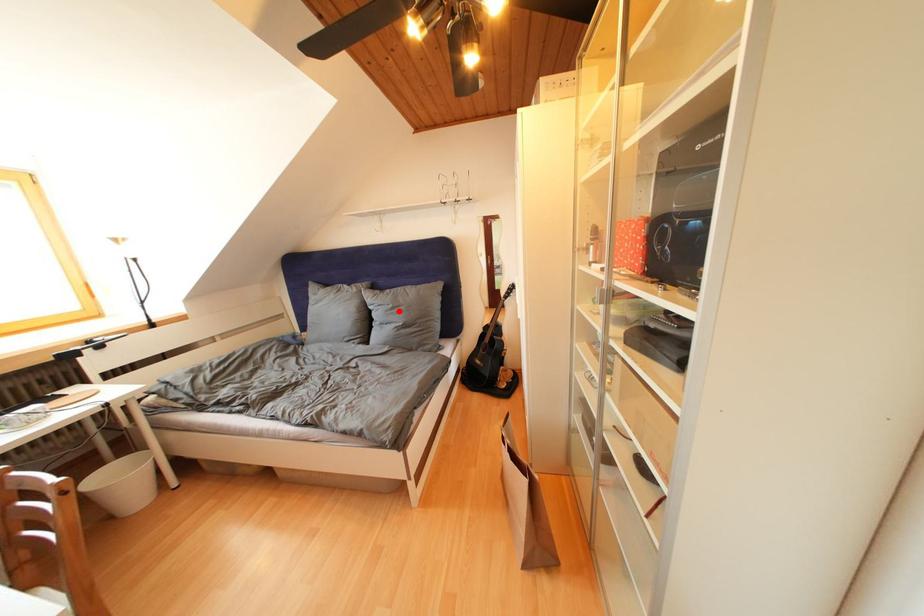
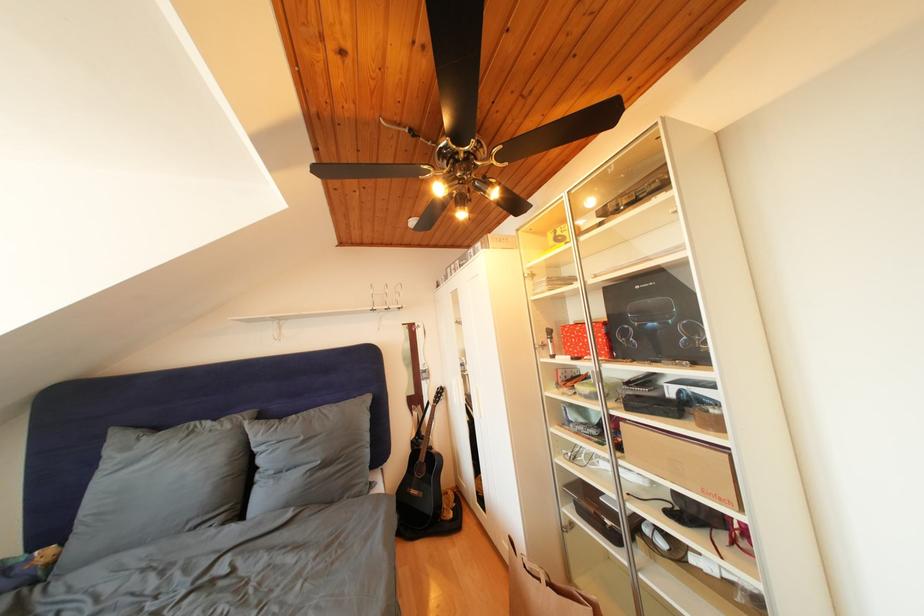
Question: I am providing you with two images of the same scene from different viewpoints. A red point is shown in image1. For the corresponding object point in image2, is it positioned nearer or farther from the camera?

Choices:
 (A) Nearer
 (B) Farther

Answer: (B)